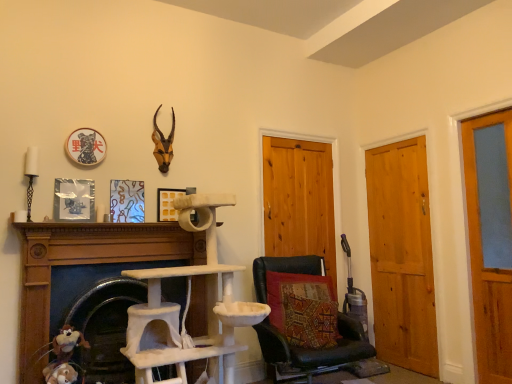
Question: Choose the correct answer: Is beige felt cat tree at lower left, the second fireplace in the left-to-right sequence, inside brown matte antlers at upper center or outside it?

Choices:
 (A) inside
 (B) outside

Answer: (B)

Question: Would you say beige felt cat tree at lower left, the second fireplace in the left-to-right sequence, is to the left or to the right of brown matte antlers at upper center in the picture?

Choices:
 (A) left
 (B) right

Answer: (A)

Question: Which object is positioned closest to the metallic silver picture frame at left, arranged as the 1th picture frame when viewed from the front?

Choices:
 (A) yellow matte picture frame at center, the 1th picture frame from the right
 (B) white textured cat tree at center, which ranks as the 2th fireplace in right-to-left order
 (C) textured fabric pillow at center
 (D) beige felt cat tree at lower left, the 1th fireplace from the right
 (E) wooden door at right, positioned as the 1th door in right-to-left order

Answer: (B)

Question: Considering the real-world distances, which object is farthest from the brown matte antlers at upper center?

Choices:
 (A) light brown wood door at right, marked as the second door in a left-to-right arrangement
 (B) wooden door at center, acting as the first door starting from the left
 (C) textured fabric pillow at center
 (D) yellow matte picture frame at center, the 1th picture frame from the right
 (E) white textured cat tree at center, which ranks as the 2th fireplace in right-to-left order

Answer: (A)